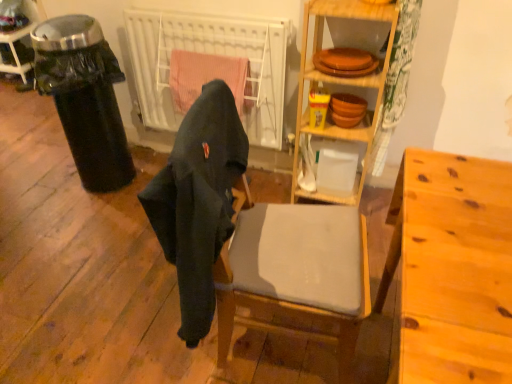
Locate an element on the screen. free location in front of black plastic trash can at left is located at coordinates [81, 223].